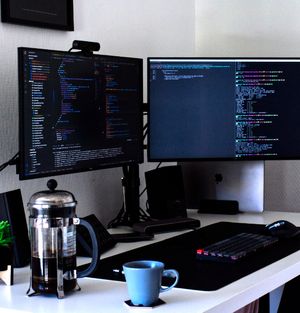
Find the location of a particular element. This screenshot has width=300, height=313. coffe mug is located at coordinates (143, 281).